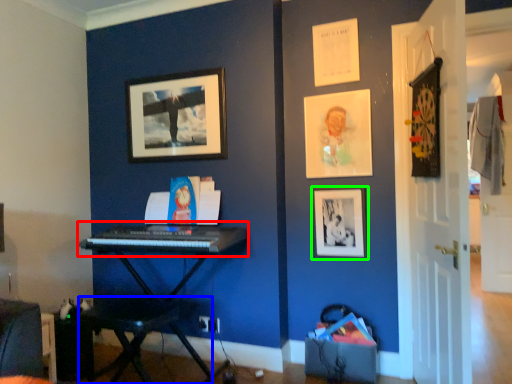
Question: Which is farther away from musical keyboard (highlighted by a red box)? table (highlighted by a blue box) or picture frame (highlighted by a green box)?

Choices:
 (A) table
 (B) picture frame

Answer: (B)